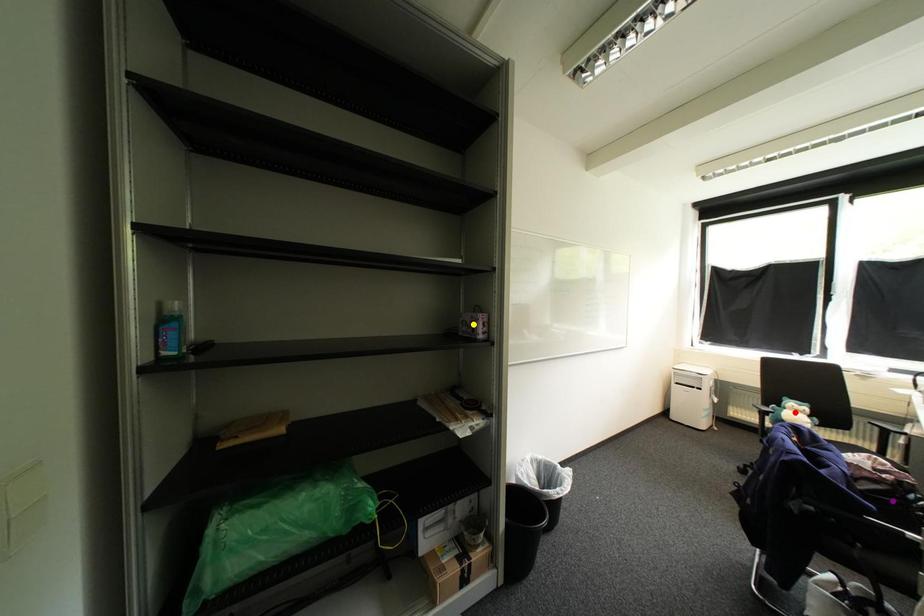
Order these from nearest to farthest:
- purple point
- yellow point
- red point

purple point < yellow point < red point